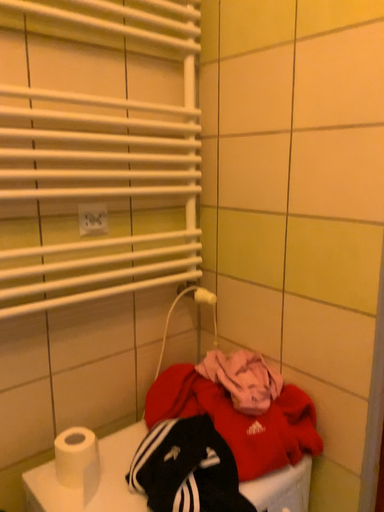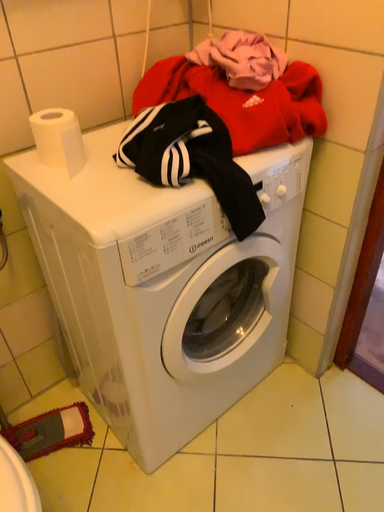
Question: Which way did the camera rotate in the video?

Choices:
 (A) rotated downward
 (B) rotated upward

Answer: (A)